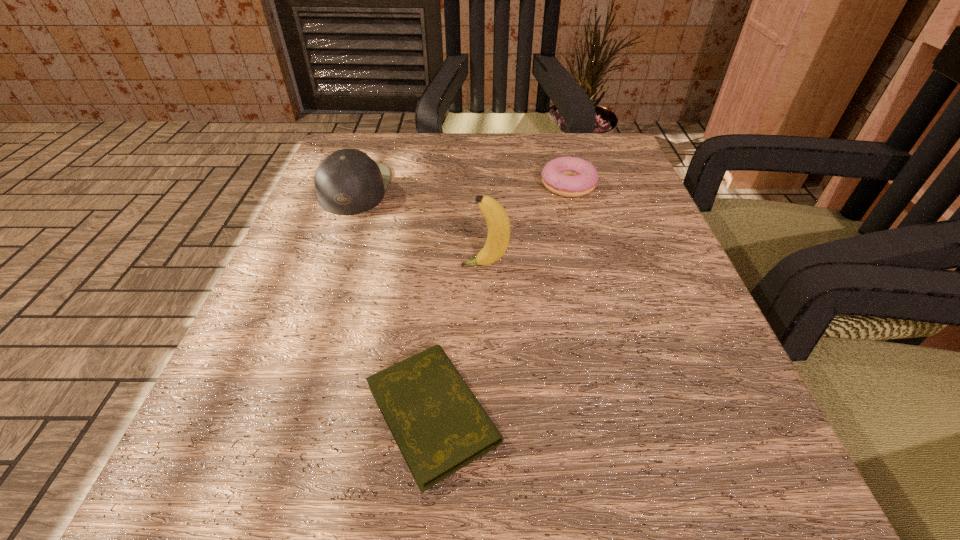
At what (x,y) coordinates should I click in order to perform the action: click on free space that satisfies the following two spatial constraints: 1. on the brim of the leftmost object; 2. on the back side of the shortest object. Please return your answer as a coordinate pair (x, y). The image size is (960, 540). Looking at the image, I should click on (272, 414).

The height and width of the screenshot is (540, 960). Identify the location of free location that satisfies the following two spatial constraints: 1. on the brim of the shortest object; 2. on the left side of the cap. (272, 414).

The image size is (960, 540). In order to click on blank area in the image that satisfies the following two spatial constraints: 1. on the brim of the third shortest object; 2. on the right side of the diary in this screenshot , I will do `click(272, 414)`.